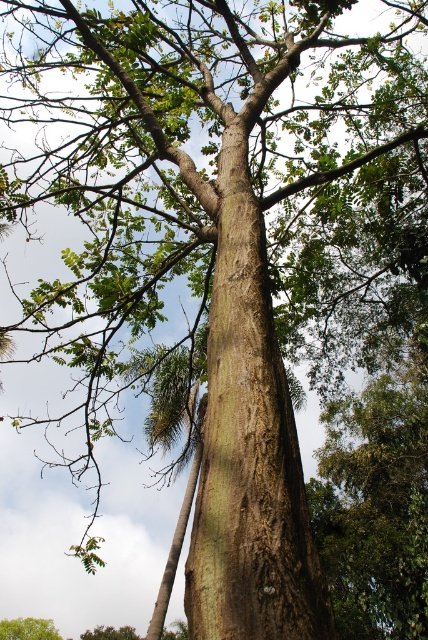
Question: Which of the following is the farthest from the observer?

Choices:
 (A) green rough bark tree at lower left
 (B) smooth brown bark at center

Answer: (A)

Question: Among these points, which one is farthest from the camera?

Choices:
 (A) (220, 429)
 (B) (41, 628)

Answer: (B)

Question: Considering the relative positions of smooth brown bark at center and green rough bark tree at lower left in the image provided, where is smooth brown bark at center located with respect to green rough bark tree at lower left?

Choices:
 (A) below
 (B) above

Answer: (B)

Question: Does smooth brown bark at center lie in front of green rough bark tree at lower left?

Choices:
 (A) no
 (B) yes

Answer: (B)

Question: Does smooth brown bark at center appear under green rough bark tree at lower left?

Choices:
 (A) no
 (B) yes

Answer: (A)